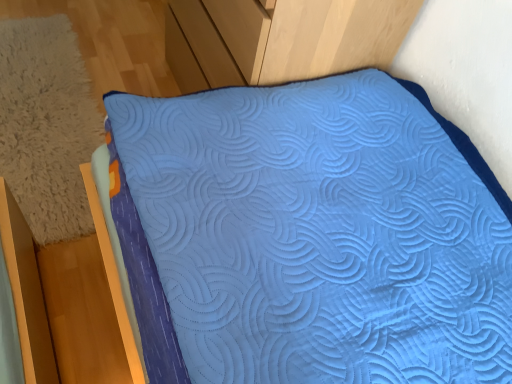
The width and height of the screenshot is (512, 384). In order to click on free region under blue quilted pillow at lower right (from a real-world perspective) in this screenshot , I will do `click(38, 103)`.